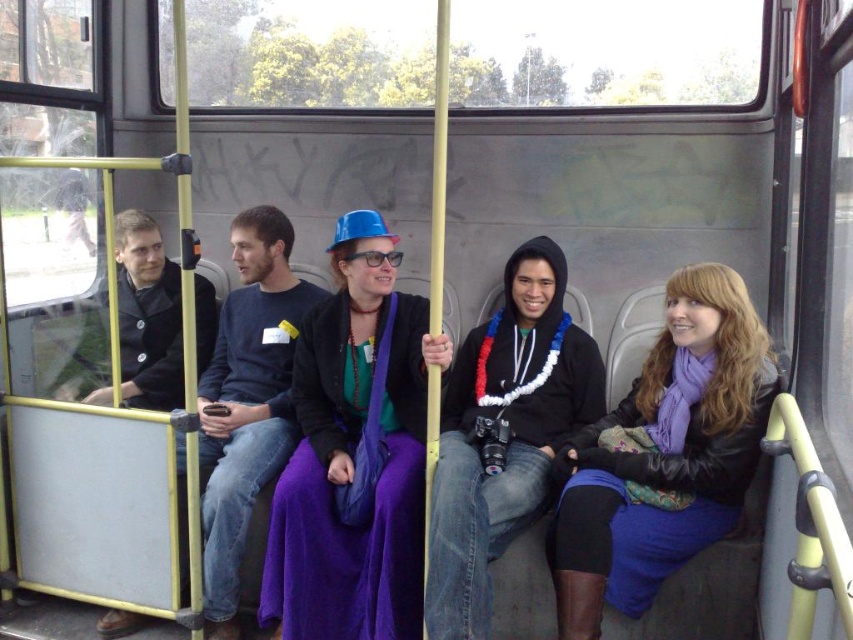
Question: Among these objects, which one is nearest to the camera?

Choices:
 (A) matte black coat at left
 (B) purple matte dress at center

Answer: (B)

Question: Which is nearer to the matte black coat at left?

Choices:
 (A) purple fabric coach at center
 (B) purple matte scarf at center
 (C) purple matte dress at center
 (D) matte black hoodie at center

Answer: (A)

Question: In this image, where is purple matte scarf at center located relative to matte black hoodie at center?

Choices:
 (A) below
 (B) above

Answer: (A)

Question: Which point is farther from the camera taking this photo?

Choices:
 (A) (225, 548)
 (B) (473, 637)
 (C) (631, 528)

Answer: (A)

Question: Does purple matte dress at center appear on the right side of matte black coat at left?

Choices:
 (A) no
 (B) yes

Answer: (B)

Question: Is the position of purple matte dress at center more distant than that of matte black hoodie at center?

Choices:
 (A) no
 (B) yes

Answer: (B)